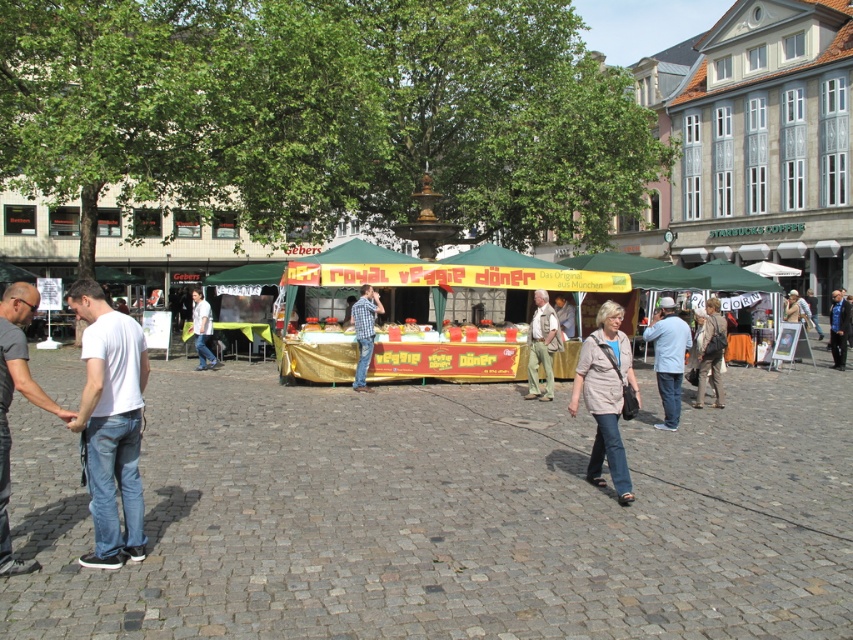
In the scene shown: Is light blue denim jeans at center further to camera compared to blue denim jeans at center?

No, light blue denim jeans at center is closer to the viewer.

Who is more distant from viewer, (670, 420) or (843, 317)?

The point (843, 317) is more distant.

The width and height of the screenshot is (853, 640). In order to click on light blue denim jeans at center in this screenshot , I will do `click(668, 358)`.

The height and width of the screenshot is (640, 853). Identify the location of light blue denim jeans at center. (668, 358).

Who is more distant from viewer, (352, 312) or (202, 330)?

Point (202, 330)

This screenshot has width=853, height=640. What do you see at coordinates (364, 332) in the screenshot?
I see `blue plaid shirt at center` at bounding box center [364, 332].

Image resolution: width=853 pixels, height=640 pixels. What do you see at coordinates (364, 332) in the screenshot? I see `blue plaid shirt at center` at bounding box center [364, 332].

The width and height of the screenshot is (853, 640). In order to click on blue plaid shirt at center in this screenshot , I will do coord(364,332).

Is dark gray t-shirt at left taller than light blue denim jeans at center?

Incorrect, dark gray t-shirt at left's height is not larger of light blue denim jeans at center's.

Who is higher up, dark gray t-shirt at left or light blue denim jeans at center?

dark gray t-shirt at left is above.

Measure the distance between point (6,300) and camera.

Point (6,300) and camera are 16.30 feet apart from each other.

Where is `dark gray t-shirt at left`? This screenshot has width=853, height=640. dark gray t-shirt at left is located at coordinates (10, 400).